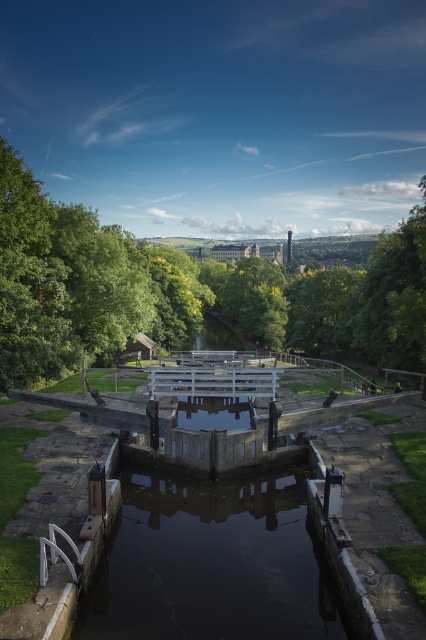
Question: Can you confirm if green leafy tree at center is bigger than dark concrete water at center?

Choices:
 (A) yes
 (B) no

Answer: (A)

Question: Among these objects, which one is nearest to the camera?

Choices:
 (A) green leafy tree at center
 (B) dark concrete water at center

Answer: (B)

Question: Among these points, which one is farthest from the camera?

Choices:
 (A) click(x=293, y=285)
 (B) click(x=212, y=620)

Answer: (A)

Question: Which object appears farthest from the camera in this image?

Choices:
 (A) dark concrete water at center
 (B) green leafy tree at center

Answer: (B)

Question: Does green leafy tree at center lie in front of dark concrete water at center?

Choices:
 (A) no
 (B) yes

Answer: (A)

Question: Can you confirm if green leafy tree at center is positioned to the left of dark concrete water at center?

Choices:
 (A) no
 (B) yes

Answer: (A)